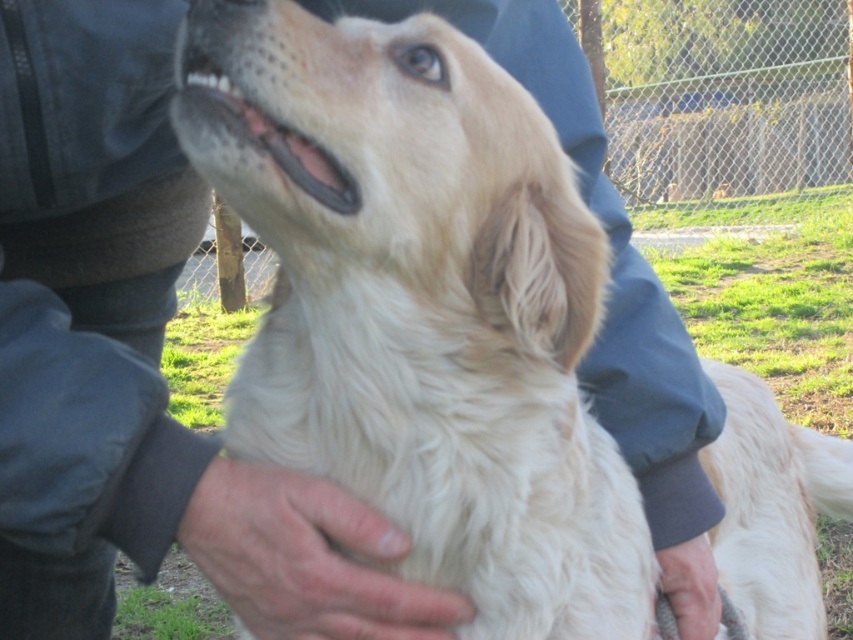
You are a photographer trying to capture the golden retriever in the image. The golden retriever is being held by a person wearing a dark jacket. You notice a point at coordinates point (305,557). What is located at that point?

At point (305,557) lies fuzzy skin at center.

You are a veterinarian examining a golden retriever held by a person. You notice the fuzzy skin at center and the smooth skin hand at lower center. Which object is covering the other?

The fuzzy skin at center is positioned over the smooth skin hand at lower center, so the fuzzy skin at center is covering the smooth skin hand at lower center.

You are a veterinarian examining a golden retriever held by a person. You need to check the dog for any skin issues. The fuzzy skin at center is part of the dog, and the smooth skin hand at lower center belongs to the person. Based on the image, which part is wider?

The fuzzy skin at center is wider than the smooth skin hand at lower center.